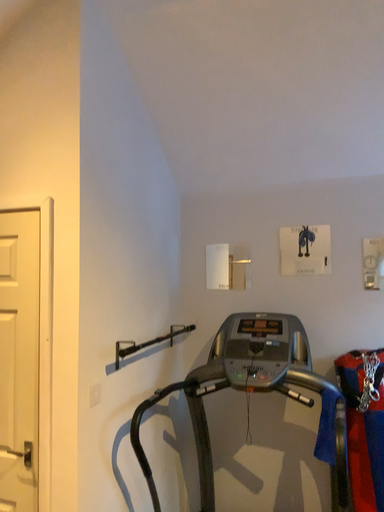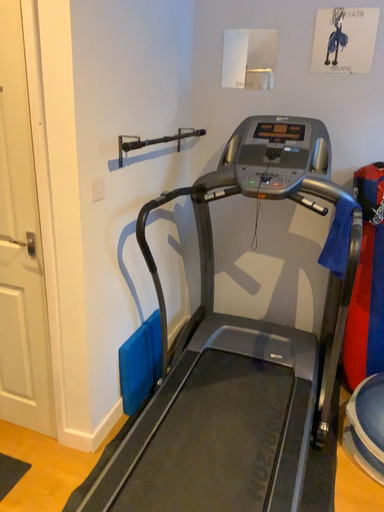
Question: Which way did the camera rotate in the video?

Choices:
 (A) rotated downward
 (B) rotated upward

Answer: (A)